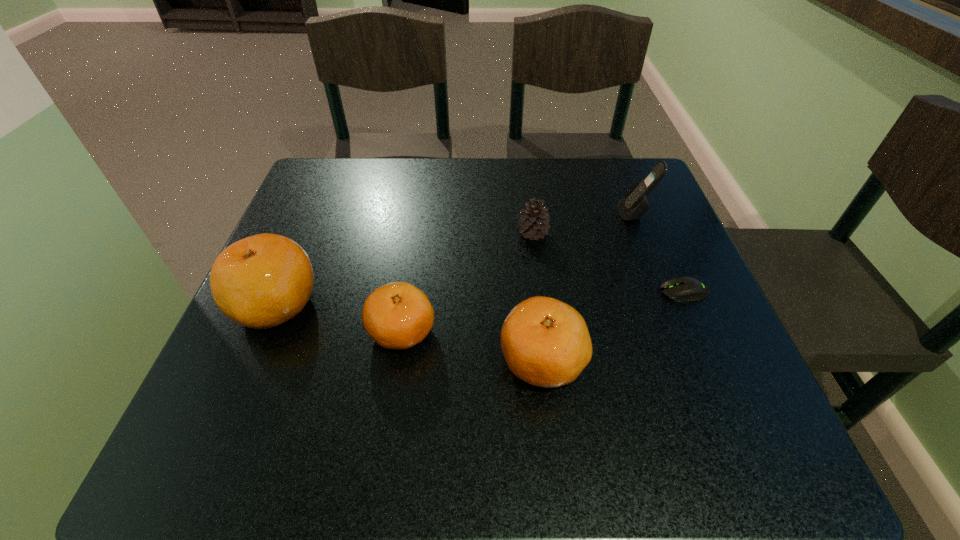
Please point a spot to add another clementine on the right. Please provide its 2D coordinates. Your answer should be formatted as a tuple, i.e. [(x, y)], where the tuple contains the x and y coordinates of a point satisfying the conditions above.

[(701, 395)]